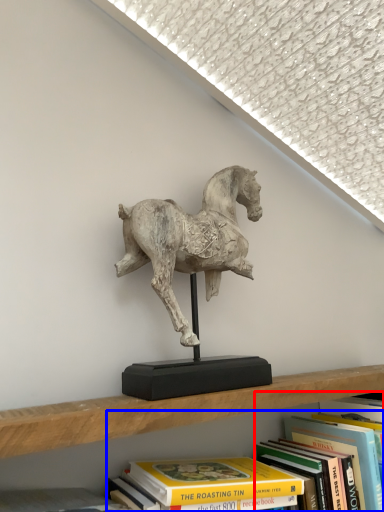
Question: Which of the following is the closest to the observer, book (highlighted by a red box) or book (highlighted by a blue box)?

Choices:
 (A) book
 (B) book

Answer: (B)